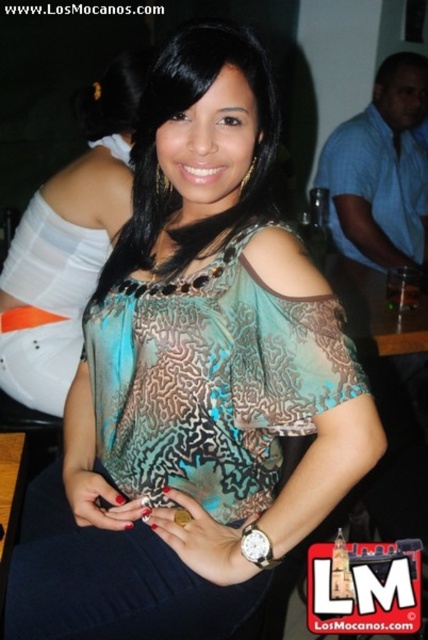
Question: Does matte teal blouse at center appear on the left side of patterned sheer blouse at center?

Choices:
 (A) yes
 (B) no

Answer: (A)

Question: Can you confirm if matte teal blouse at center is thinner than patterned sheer blouse at center?

Choices:
 (A) yes
 (B) no

Answer: (B)

Question: From the image, what is the correct spatial relationship of matte teal blouse at center in relation to patterned sheer blouse at center?

Choices:
 (A) left
 (B) right

Answer: (A)

Question: Which point is closer to the camera?

Choices:
 (A) (47, 372)
 (B) (238, 212)

Answer: (B)